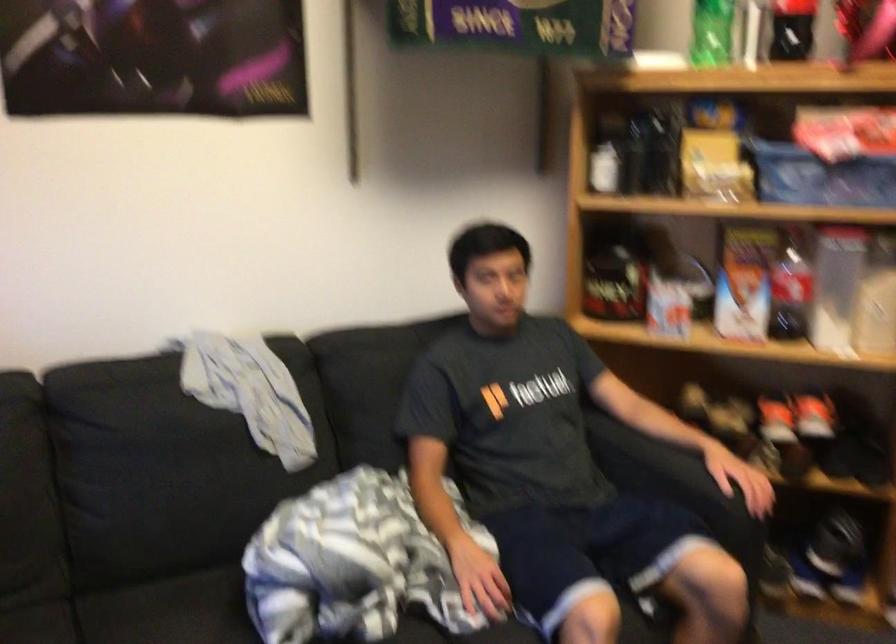
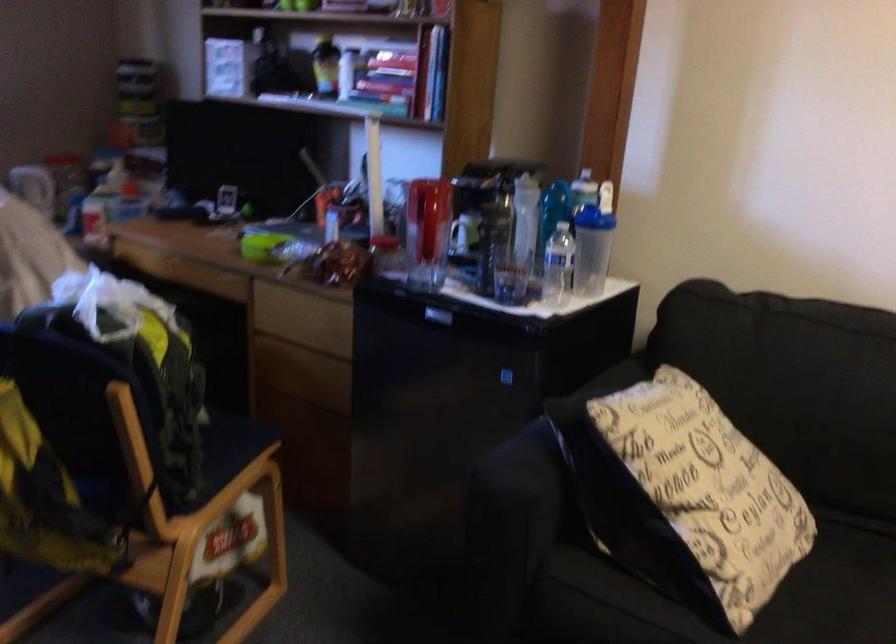
Question: The camera is either moving clockwise (left) or counter-clockwise (right) around the object. The first image is from the beginning of the video and the second image is from the end. Is the camera moving left or right when shooting the video?

Choices:
 (A) Left
 (B) Right

Answer: (B)